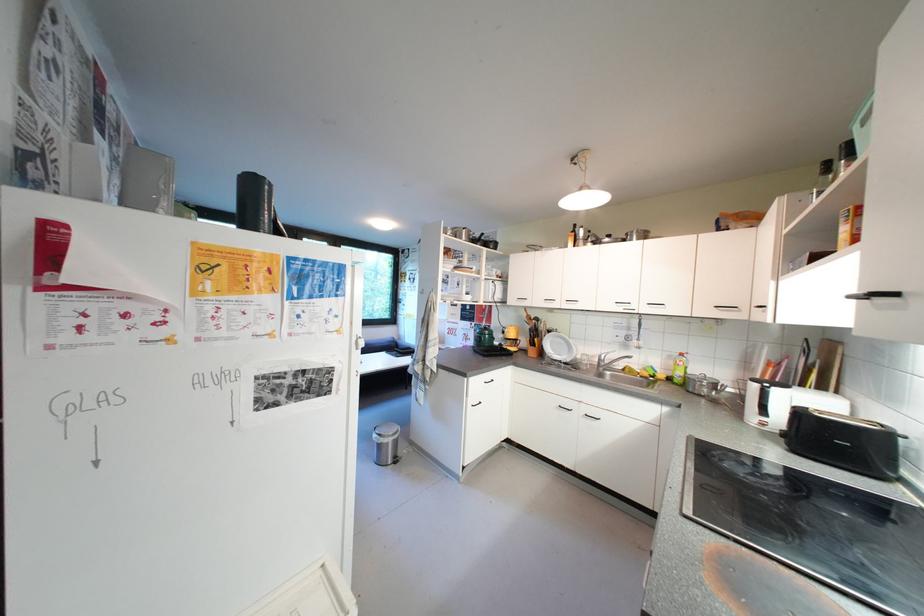
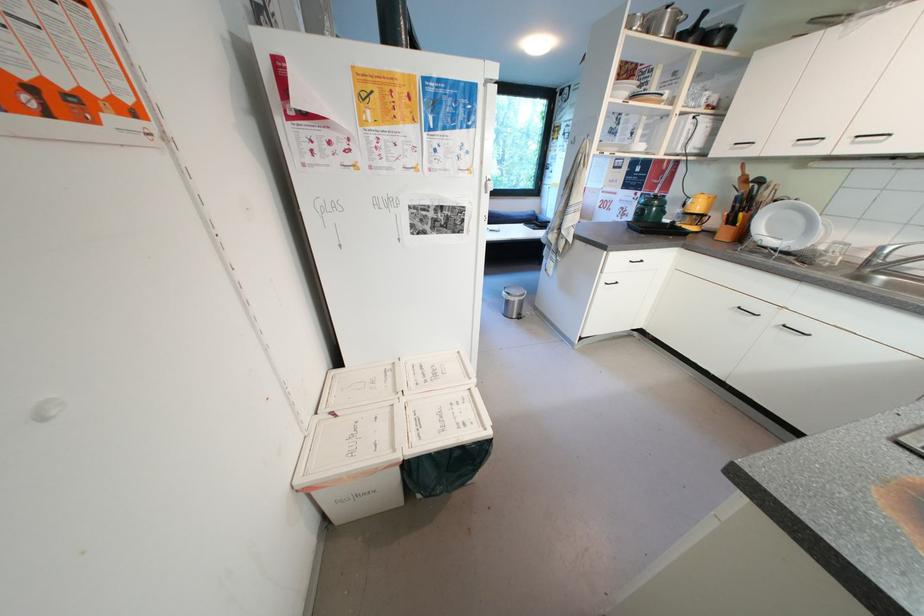
Find the pixel in the second image that matches [550,355] in the first image.

(749, 238)